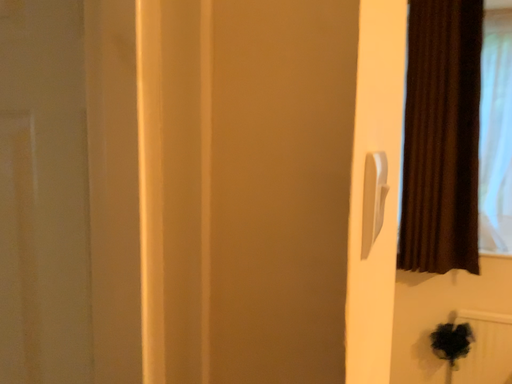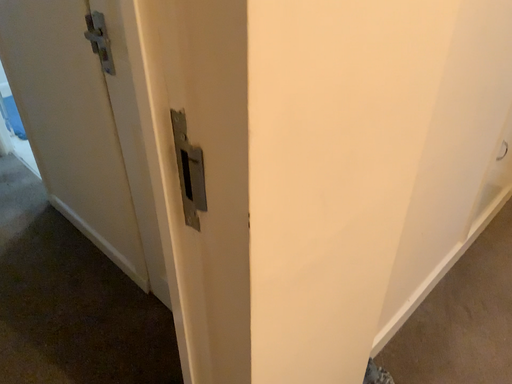
Question: Which way did the camera rotate in the video?

Choices:
 (A) rotated upward
 (B) rotated downward

Answer: (B)